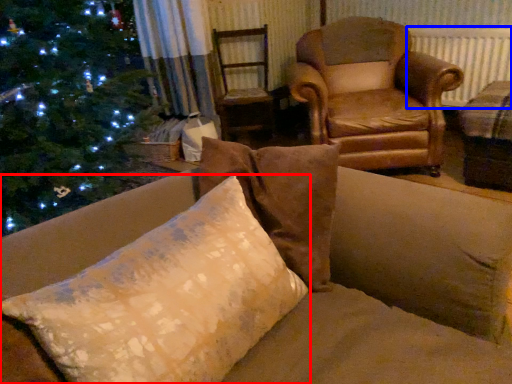
Question: Which of the following is the farthest to the observer, pillow (highlighted by a red box) or radiator (highlighted by a blue box)?

Choices:
 (A) pillow
 (B) radiator

Answer: (B)